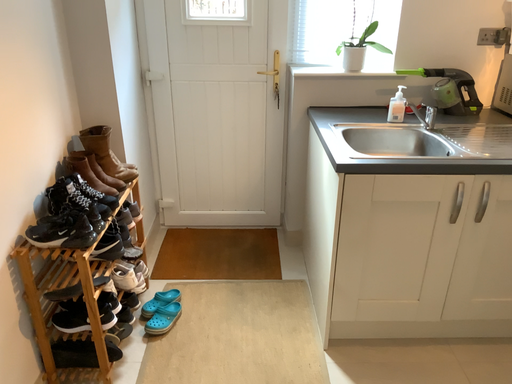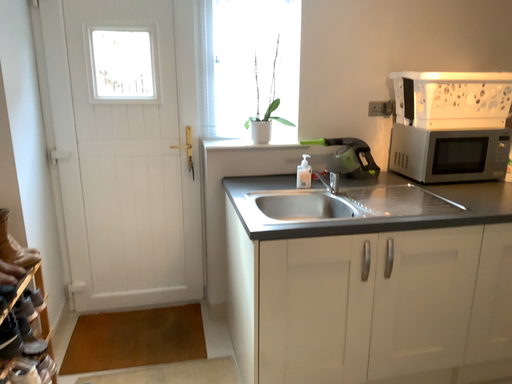
Question: Which way did the camera rotate in the video?

Choices:
 (A) rotated right
 (B) rotated left

Answer: (A)